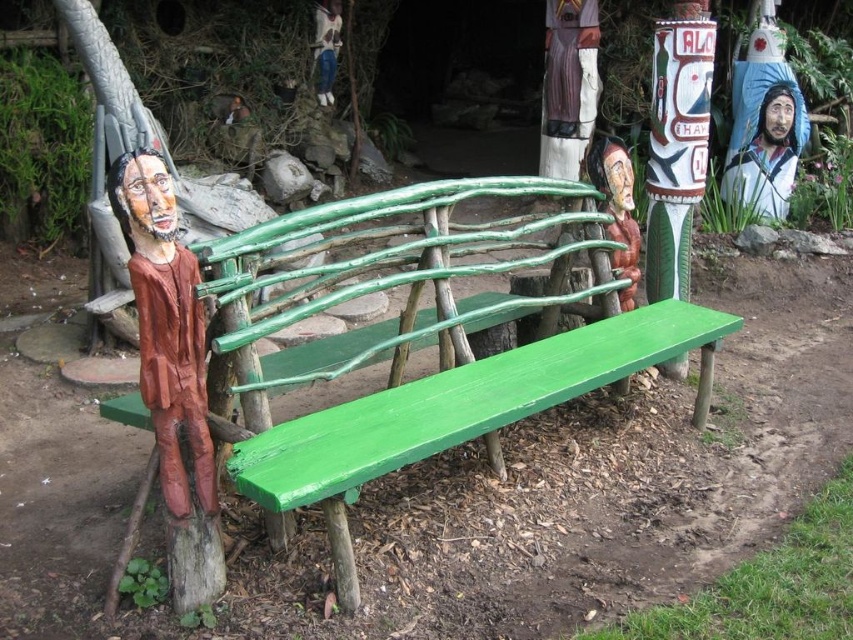
Can you confirm if green painted wood bench at center is positioned to the right of wooden totem pole at upper center?

In fact, green painted wood bench at center is to the left of wooden totem pole at upper center.

The image size is (853, 640). What do you see at coordinates (426, 344) in the screenshot? I see `green painted wood bench at center` at bounding box center [426, 344].

This screenshot has width=853, height=640. Identify the location of green painted wood bench at center. (426, 344).

Is green painted wood bench at center below wooden figure at left?

Indeed, green painted wood bench at center is positioned under wooden figure at left.

The width and height of the screenshot is (853, 640). Describe the element at coordinates (426, 344) in the screenshot. I see `green painted wood bench at center` at that location.

Measure the distance between green painted wood bench at center and camera.

They are 5.66 feet apart.

Locate an element on the screen. green painted wood bench at center is located at coordinates (426, 344).

Between wooden totem pole at upper center and wooden figure at center, which one is positioned higher?

wooden totem pole at upper center is above.

Between wooden totem pole at upper center and wooden figure at center, which one is positioned lower?

wooden figure at center

Describe the element at coordinates (567, 84) in the screenshot. This screenshot has height=640, width=853. I see `wooden totem pole at upper center` at that location.

Locate an element on the screen. The image size is (853, 640). wooden totem pole at upper center is located at coordinates (567, 84).